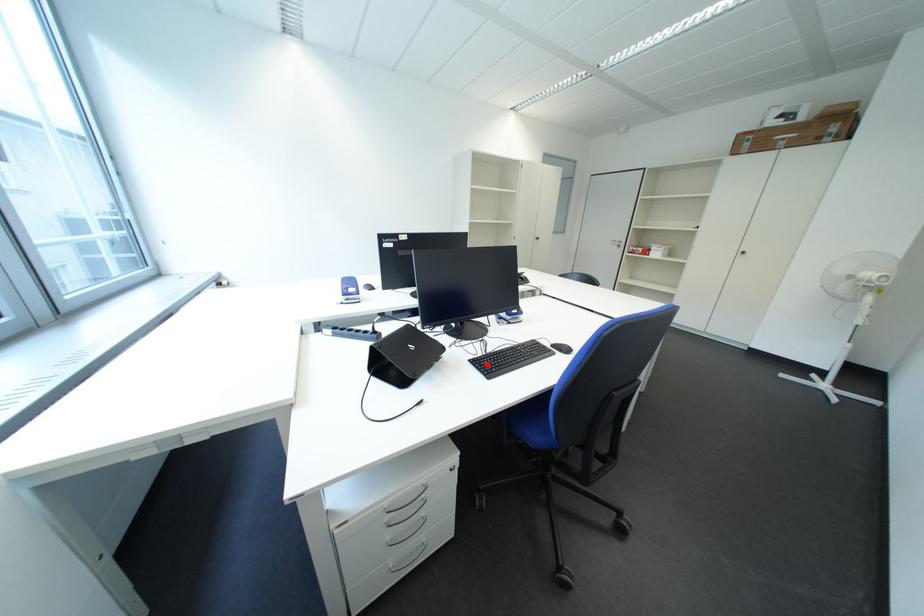
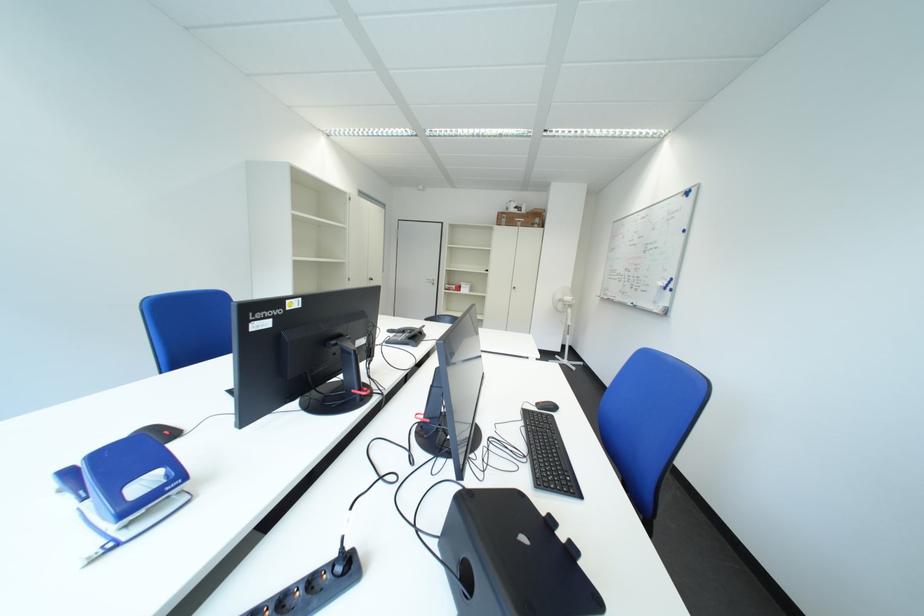
Where in the second image is the point corresponding to the highlighted location from the first image?

(553, 485)